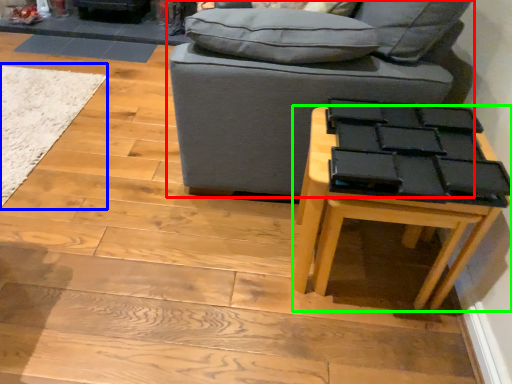
Question: Considering the real-world distances, which object is farthest from studio couch (highlighted by a red box)? mat (highlighted by a blue box) or table (highlighted by a green box)?

Choices:
 (A) mat
 (B) table

Answer: (A)